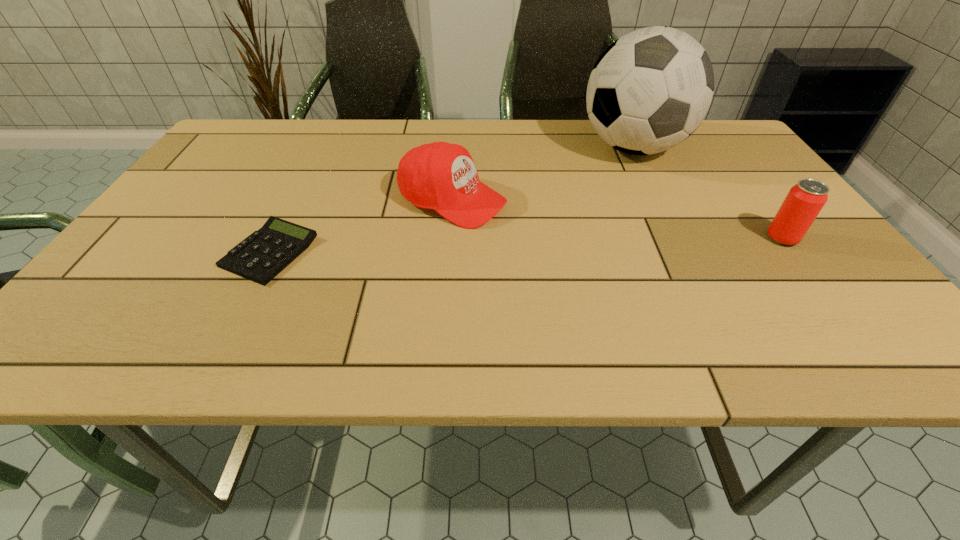
Image resolution: width=960 pixels, height=540 pixels. I want to click on vacant space on the desktop that is between the calculator and the rightmost object and is positioned on the main logo of the second object from right to left, so click(x=586, y=244).

The height and width of the screenshot is (540, 960). I want to click on free space on the desktop that is between the calculator and the beer can and is positioned on the front panel of the second object from left to right, so click(x=567, y=244).